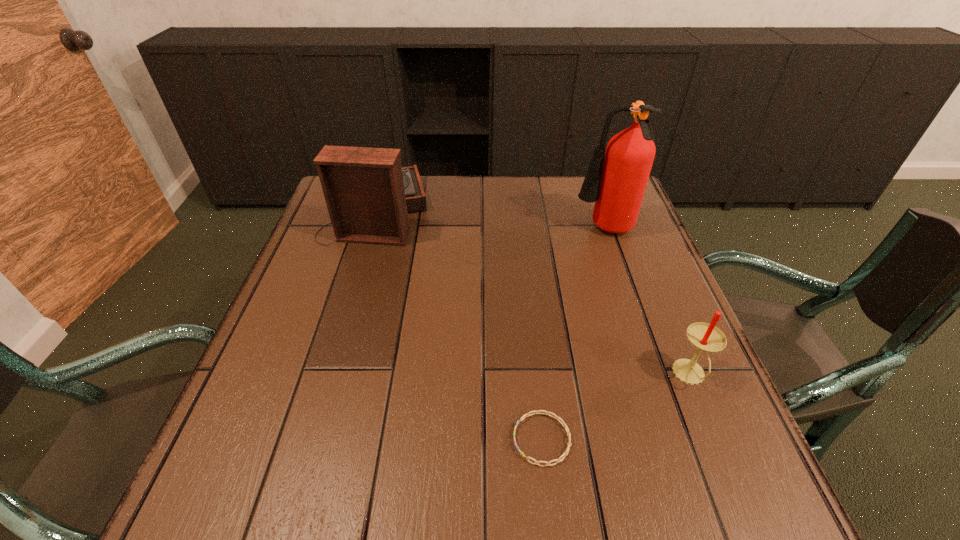
At what (x,y) coordinates should I click in order to perform the action: click on vacant space located on the right of the leftmost object. Please return your answer as a coordinate pair (x, y). This screenshot has height=540, width=960. Looking at the image, I should click on (473, 210).

Where is `free space located 0.190m on the left of the third tallest object`? free space located 0.190m on the left of the third tallest object is located at coordinates (573, 375).

Identify the location of vacant space located on the surface of the nearest object showing star-shaped elements. (455, 439).

At what (x,y) coordinates should I click in order to perform the action: click on vacant space located 0.160m on the surface of the nearest object showing star-shaped elements. Please return your answer as a coordinate pair (x, y). Looking at the image, I should click on (420, 439).

This screenshot has width=960, height=540. What are the coordinates of `vacant area located 0.090m on the surface of the nearest object showing star-shaped elements` in the screenshot? It's located at (461, 439).

What are the coordinates of `fire extinguisher present at the far edge` in the screenshot? It's located at (616, 179).

Find the location of a particular element. phonograph record that is at the far edge is located at coordinates (368, 194).

Find the location of a particular element. Image resolution: width=960 pixels, height=540 pixels. object present at the near edge is located at coordinates (524, 416).

The height and width of the screenshot is (540, 960). I want to click on object that is at the left edge, so click(368, 194).

Locate an element on the screen. The width and height of the screenshot is (960, 540). fire extinguisher that is positioned at the right edge is located at coordinates (616, 179).